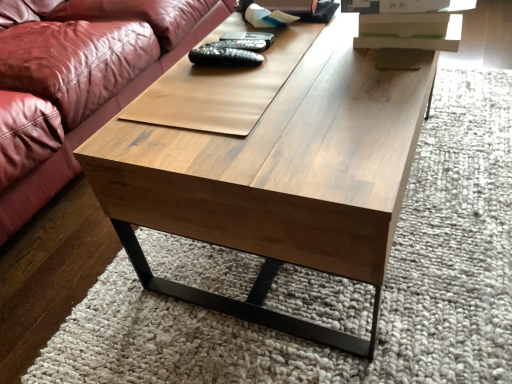
Question: From the image's perspective, does black plastic remote at center, the 3th remote ordered from the bottom, appear lower than black matte remote at center, which ranks as the second remote in top-to-bottom order?

Choices:
 (A) no
 (B) yes

Answer: (A)

Question: From a real-world perspective, is black plastic remote at center, the 3th remote ordered from the bottom, physically below black matte remote at center, positioned as the second remote in bottom-to-top order?

Choices:
 (A) no
 (B) yes

Answer: (A)

Question: Would you say black matte remote at center, positioned as the second remote in bottom-to-top order, is part of black plastic remote at center, the 3th remote ordered from the bottom,'s contents?

Choices:
 (A) yes
 (B) no

Answer: (B)

Question: Can you confirm if black plastic remote at center, which ranks as the first remote in top-to-bottom order, is smaller than black matte remote at center, positioned as the second remote in bottom-to-top order?

Choices:
 (A) no
 (B) yes

Answer: (A)

Question: Is black plastic remote at center, the 3th remote ordered from the bottom, aimed at black matte remote at center, positioned as the second remote in bottom-to-top order?

Choices:
 (A) yes
 (B) no

Answer: (B)

Question: Would you consider black plastic remote at center, the 3th remote ordered from the bottom, to be distant from black matte remote at center, which ranks as the second remote in top-to-bottom order?

Choices:
 (A) yes
 (B) no

Answer: (B)

Question: Can you confirm if black matte remote at center, which ranks as the second remote in top-to-bottom order, is wider than black matte remote at center, the 3th remote when ordered from top to bottom?

Choices:
 (A) yes
 (B) no

Answer: (A)

Question: Can you confirm if black matte remote at center, positioned as the second remote in bottom-to-top order, is smaller than black matte remote at center, the 3th remote when ordered from top to bottom?

Choices:
 (A) yes
 (B) no

Answer: (A)

Question: Does black matte remote at center, positioned as the second remote in bottom-to-top order, have a lesser height compared to black matte remote at center, positioned as the first remote in bottom-to-top order?

Choices:
 (A) yes
 (B) no

Answer: (A)

Question: Are black matte remote at center, which ranks as the second remote in top-to-bottom order, and black matte remote at center, the 3th remote when ordered from top to bottom, far apart?

Choices:
 (A) no
 (B) yes

Answer: (A)

Question: Is black matte remote at center, positioned as the second remote in bottom-to-top order, positioned behind black matte remote at center, the 3th remote when ordered from top to bottom?

Choices:
 (A) no
 (B) yes

Answer: (B)

Question: From the image's perspective, would you say black matte remote at center, which ranks as the second remote in top-to-bottom order, is shown under black matte remote at center, the 3th remote when ordered from top to bottom?

Choices:
 (A) yes
 (B) no

Answer: (B)

Question: Is black matte remote at center, the 3th remote when ordered from top to bottom, positioned in front of wooden coffee table at center?

Choices:
 (A) no
 (B) yes

Answer: (A)